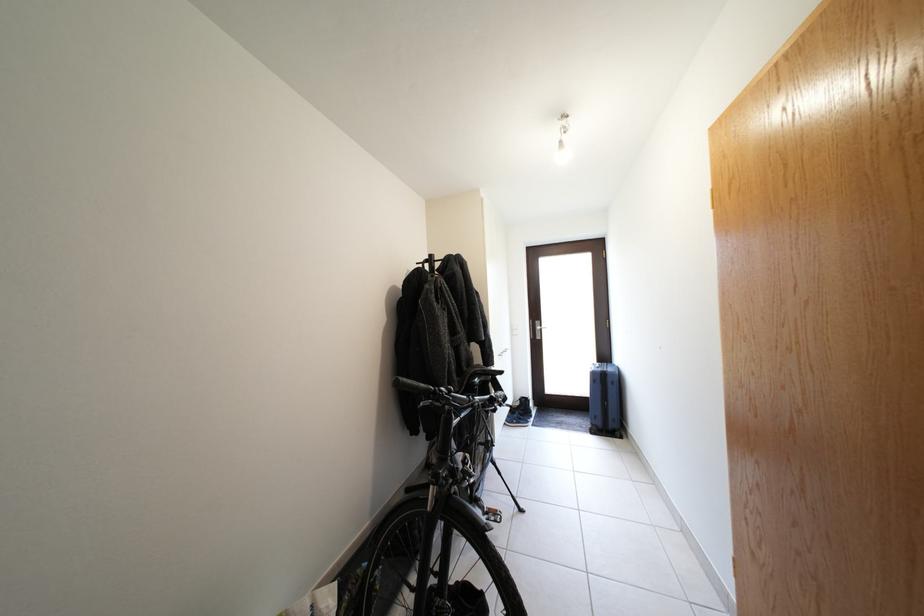
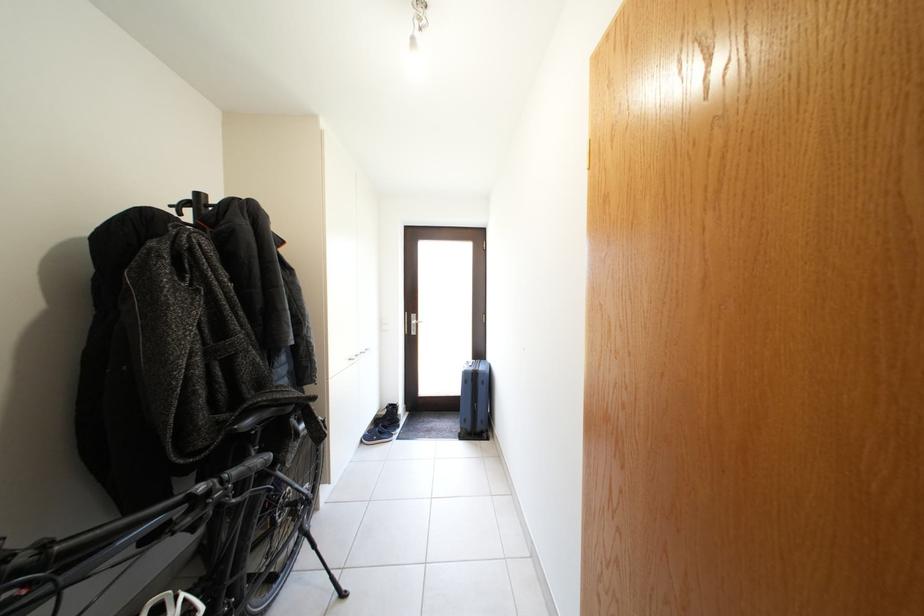
Locate, in the second image, the point that corresponds to point (492, 377) in the first image.

(286, 406)